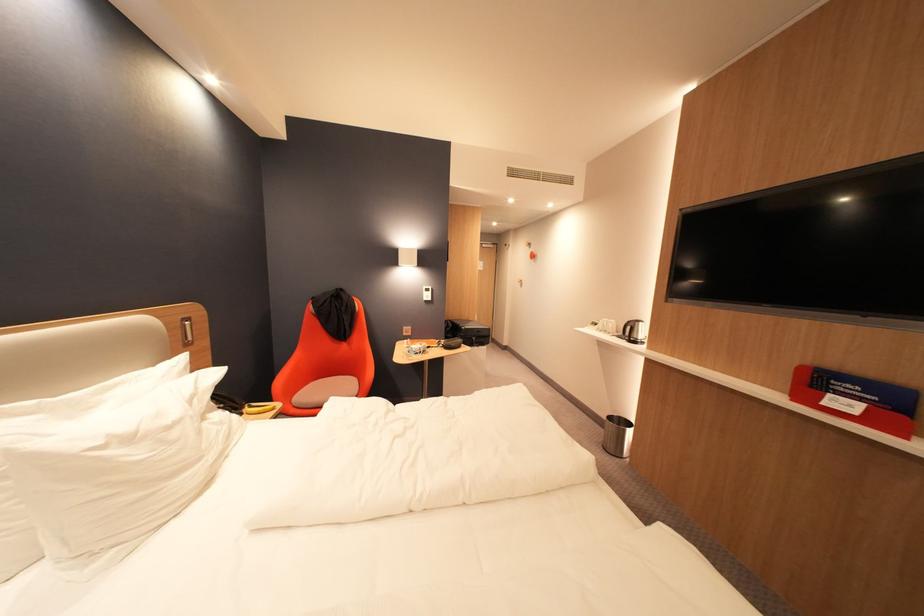
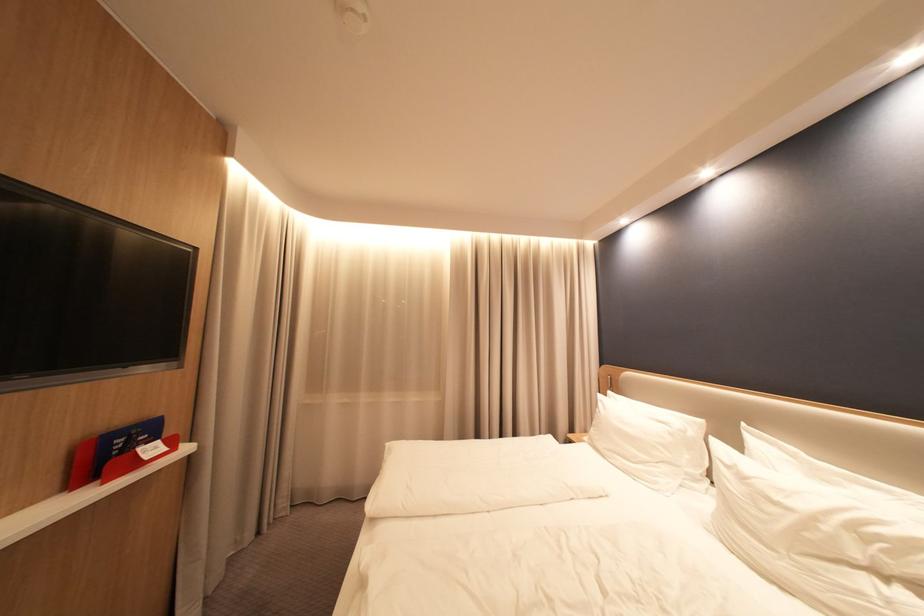
Where in the second image is the point corresponding to point (108, 444) from the first image?

(737, 464)